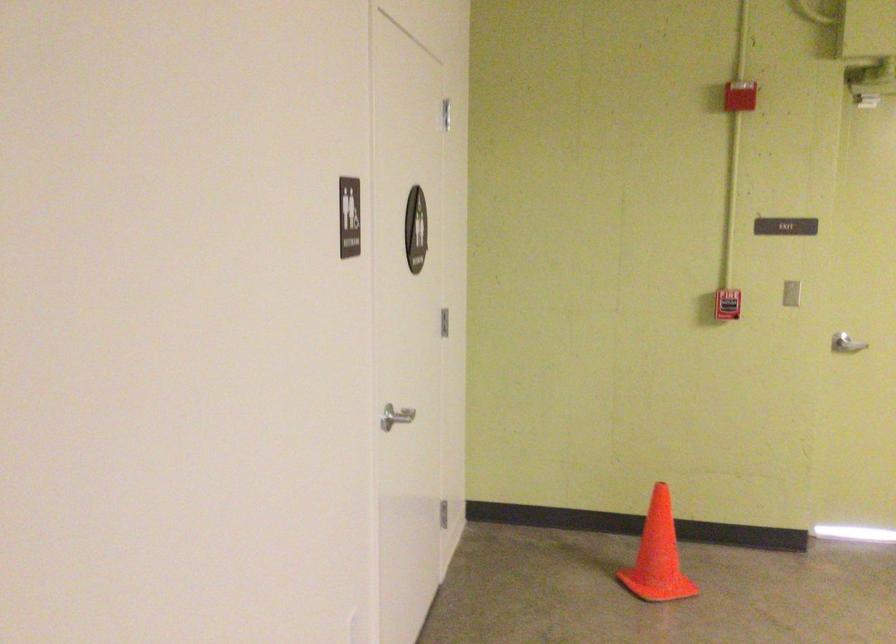
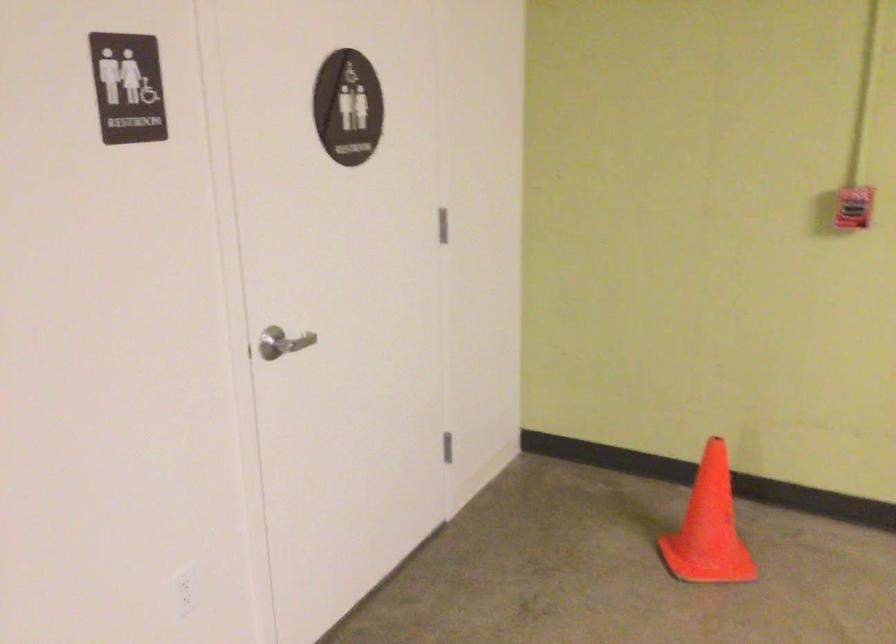
What movement of the cameraman would produce the second image?

The movement direction of the cameraman is right, forward.